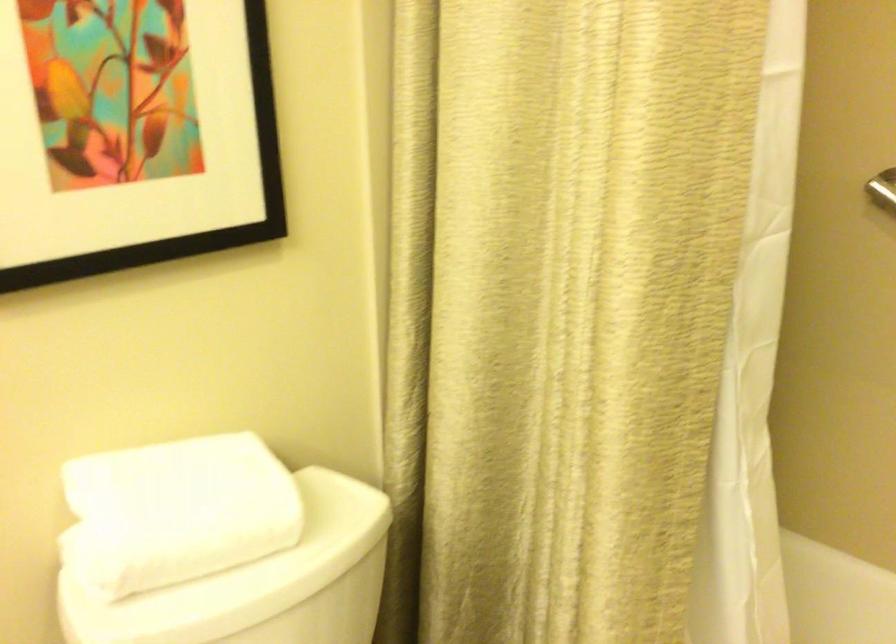
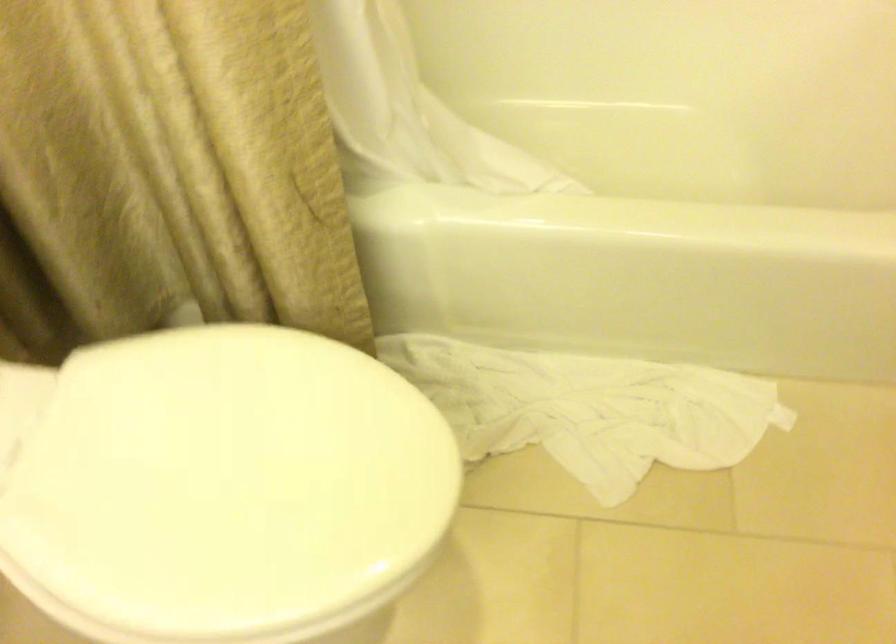
In the scene shown: First-person continuous shooting, in which direction is the camera rotating?

The camera rotated toward right-down.